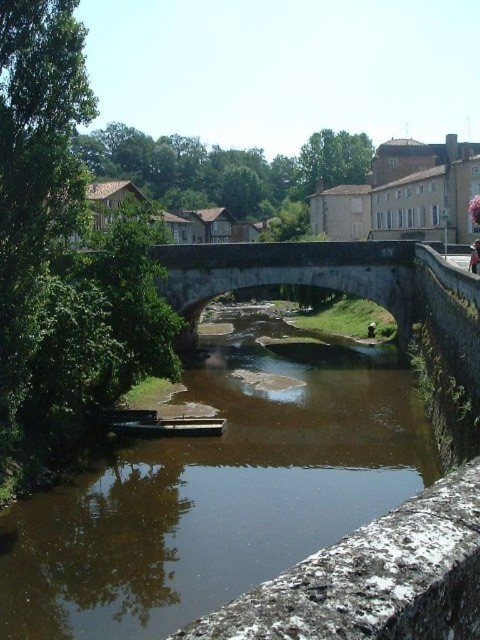
Question: Is brown stone river at center positioned in front of light pink fabric at center?

Choices:
 (A) yes
 (B) no

Answer: (A)

Question: Does brown stone river at center appear on the right side of light pink fabric at center?

Choices:
 (A) no
 (B) yes

Answer: (A)

Question: Which object is closer to the camera taking this photo?

Choices:
 (A) brown stone river at center
 (B) light pink fabric at center

Answer: (A)

Question: Which point is closer to the camera?

Choices:
 (A) light pink fabric at center
 (B) brown stone river at center

Answer: (B)

Question: Is the position of brown stone river at center less distant than that of light pink fabric at center?

Choices:
 (A) no
 (B) yes

Answer: (B)

Question: Among these points, which one is nearest to the camera?

Choices:
 (A) (475, 262)
 (B) (224, 358)

Answer: (A)